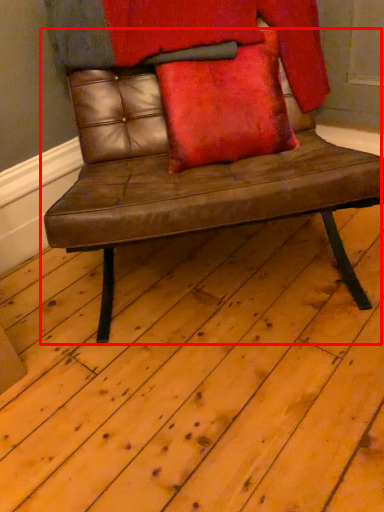
Question: Considering the relative positions of chair (annotated by the red box) and pillow in the image provided, where is chair (annotated by the red box) located with respect to the staircase?

Choices:
 (A) left
 (B) right

Answer: (A)